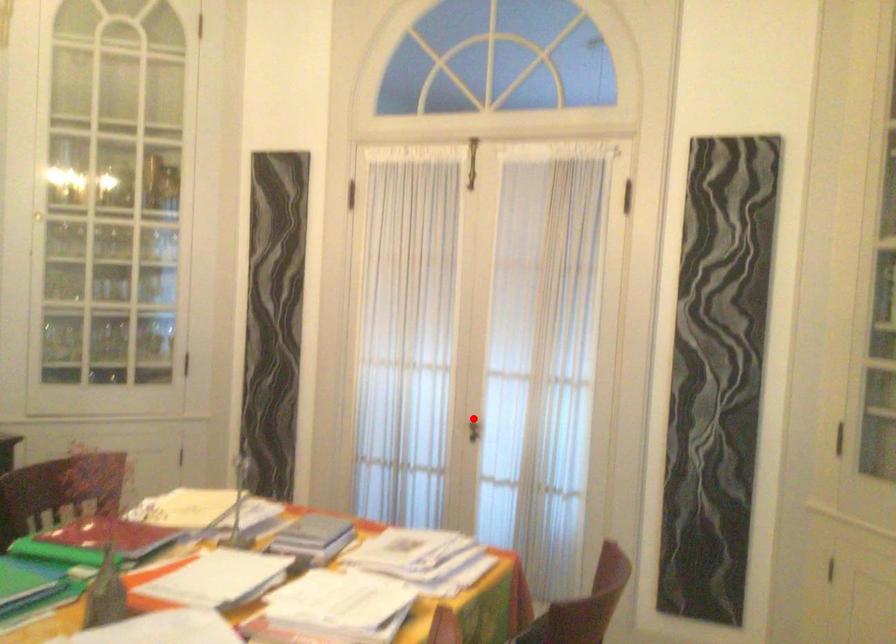
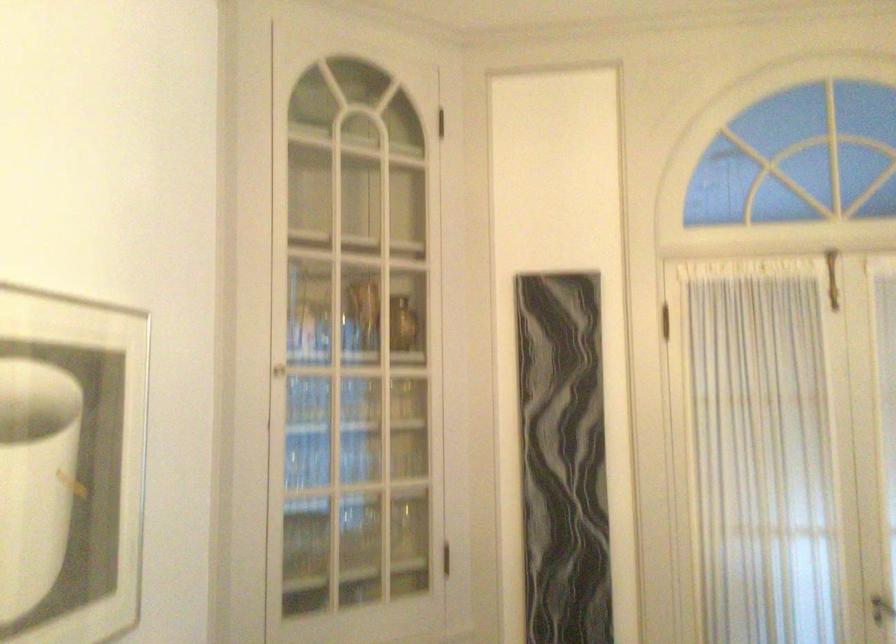
Where in the second image is the point corresponding to the highlighted location from the first image?

(882, 609)